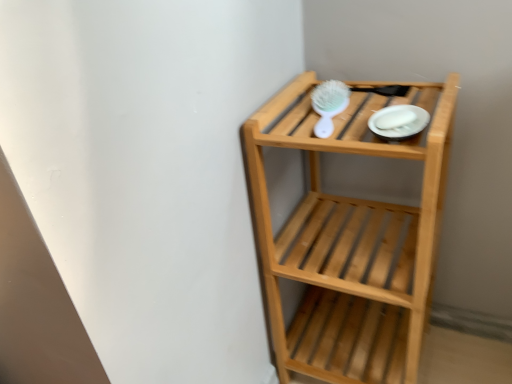
Question: Is white glossy plate at upper right to the right of natural wood shelf at upper right from the viewer's perspective?

Choices:
 (A) no
 (B) yes

Answer: (A)

Question: Is natural wood shelf at upper right inside white glossy plate at upper right?

Choices:
 (A) yes
 (B) no

Answer: (B)

Question: Does white glossy plate at upper right touch natural wood shelf at upper right?

Choices:
 (A) yes
 (B) no

Answer: (B)

Question: Is white glossy plate at upper right not inside natural wood shelf at upper right?

Choices:
 (A) yes
 (B) no

Answer: (B)

Question: Is white glossy plate at upper right positioned with its back to natural wood shelf at upper right?

Choices:
 (A) yes
 (B) no

Answer: (A)

Question: Is white glossy plate at upper right to the left of natural wood shelf at upper right from the viewer's perspective?

Choices:
 (A) no
 (B) yes

Answer: (B)

Question: From the image's perspective, would you say white plastic brush at upper center is positioned over white glossy plate at upper right?

Choices:
 (A) yes
 (B) no

Answer: (A)

Question: Could you tell me if white plastic brush at upper center is facing white glossy plate at upper right?

Choices:
 (A) yes
 (B) no

Answer: (B)

Question: Is white plastic brush at upper center taller than white glossy plate at upper right?

Choices:
 (A) yes
 (B) no

Answer: (A)

Question: Is white plastic brush at upper center to the left of white glossy plate at upper right from the viewer's perspective?

Choices:
 (A) yes
 (B) no

Answer: (A)

Question: Is white plastic brush at upper center next to white glossy plate at upper right?

Choices:
 (A) no
 (B) yes

Answer: (A)

Question: Does white plastic brush at upper center have a greater width compared to white glossy plate at upper right?

Choices:
 (A) no
 (B) yes

Answer: (B)

Question: Is natural wood shelf at upper right closer to the viewer compared to white glossy plate at upper right?

Choices:
 (A) yes
 (B) no

Answer: (A)